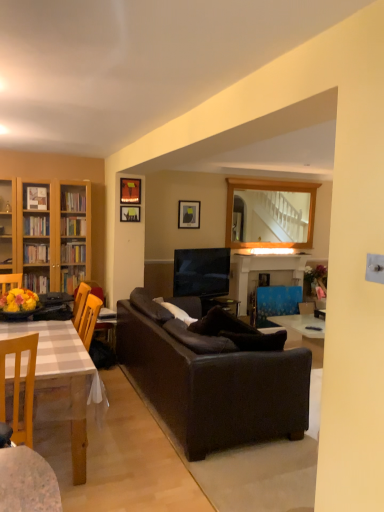
Question: From a real-world perspective, is wooden chair at lower left positioned under blue painted wood fireplace at center based on gravity?

Choices:
 (A) yes
 (B) no

Answer: (A)

Question: Considering the relative sizes of wooden chair at lower left and blue painted wood fireplace at center in the image provided, is wooden chair at lower left wider than blue painted wood fireplace at center?

Choices:
 (A) no
 (B) yes

Answer: (B)

Question: Is wooden chair at lower left turned away from blue painted wood fireplace at center?

Choices:
 (A) yes
 (B) no

Answer: (B)

Question: Is blue painted wood fireplace at center located within wooden chair at lower left?

Choices:
 (A) yes
 (B) no

Answer: (B)

Question: Considering the relative positions of wooden chair at lower left and blue painted wood fireplace at center in the image provided, is wooden chair at lower left behind blue painted wood fireplace at center?

Choices:
 (A) yes
 (B) no

Answer: (B)

Question: From a real-world perspective, is wooden chair at lower left over blue painted wood fireplace at center?

Choices:
 (A) yes
 (B) no

Answer: (B)

Question: Is white checkered table at left facing towards matte black picture frame at upper center, which ranks as the second picture frame in back-to-front order?

Choices:
 (A) yes
 (B) no

Answer: (B)

Question: Considering the relative sizes of white checkered table at left and matte black picture frame at upper center, the 1th picture frame when ordered from left to right, in the image provided, is white checkered table at left bigger than matte black picture frame at upper center, the 1th picture frame when ordered from left to right,?

Choices:
 (A) no
 (B) yes

Answer: (B)

Question: From a real-world perspective, is white checkered table at left physically above matte black picture frame at upper center, which ranks as the second picture frame in back-to-front order?

Choices:
 (A) no
 (B) yes

Answer: (A)

Question: Is white checkered table at left turned away from matte black picture frame at upper center, which ranks as the second picture frame in back-to-front order?

Choices:
 (A) yes
 (B) no

Answer: (B)

Question: Is matte black picture frame at upper center, which ranks as the second picture frame in back-to-front order, located within white checkered table at left?

Choices:
 (A) yes
 (B) no

Answer: (B)

Question: Can you confirm if white checkered table at left is smaller than matte black picture frame at upper center, positioned as the third picture frame in right-to-left order?

Choices:
 (A) no
 (B) yes

Answer: (A)

Question: Can you confirm if blue fabric swivel chair at center is wider than matte black picture frame at upper center, acting as the first picture frame starting from the right?

Choices:
 (A) yes
 (B) no

Answer: (A)